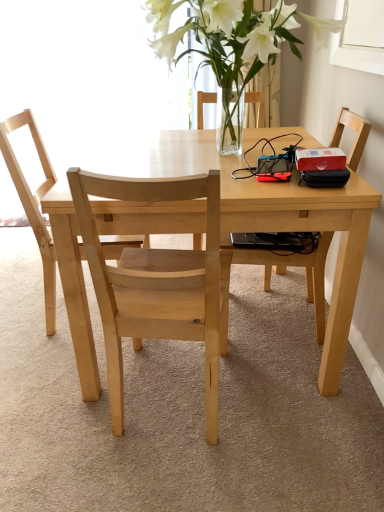
I want to click on vacant space in front of natural wood chair at center, which appears as the 2th chair when viewed from the right, so click(x=173, y=478).